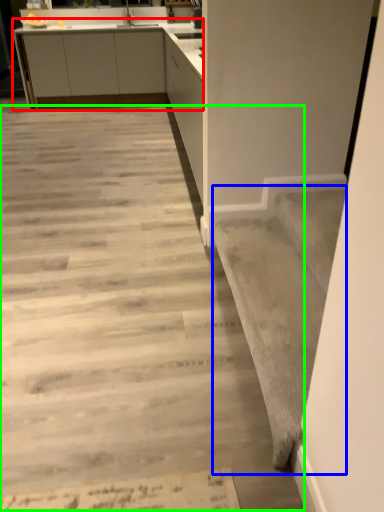
Question: Which object is positioned farthest from cabinetry (highlighted by a red box)? Select from stairwell (highlighted by a blue box) and concrete (highlighted by a green box).

Choices:
 (A) stairwell
 (B) concrete

Answer: (A)